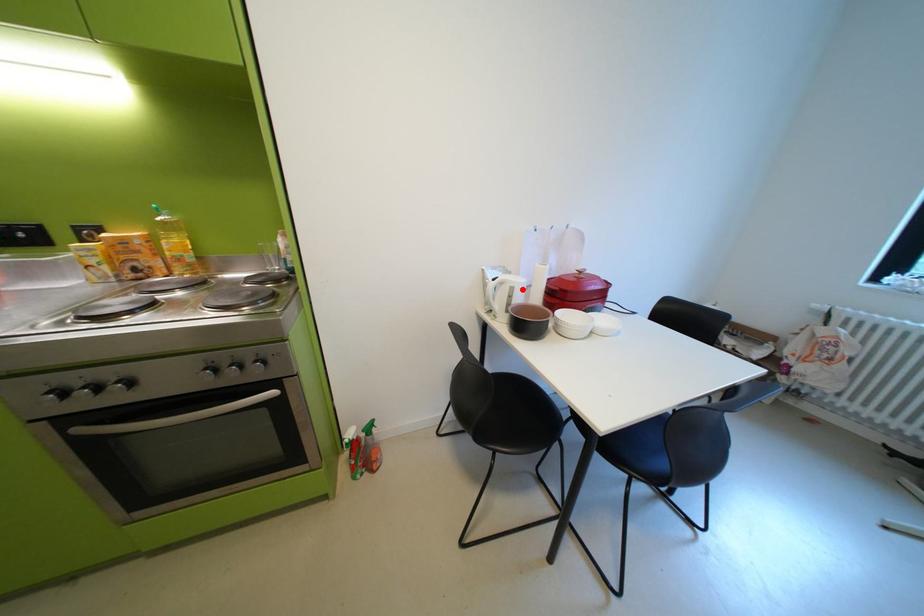
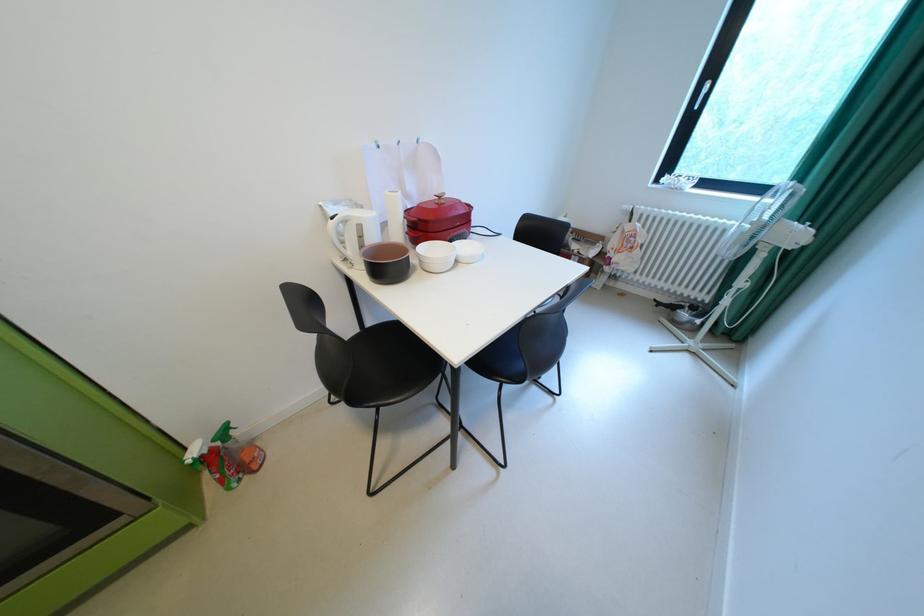
Where in the second image is the point corresponding to the highlighted location from the first image?

(370, 227)